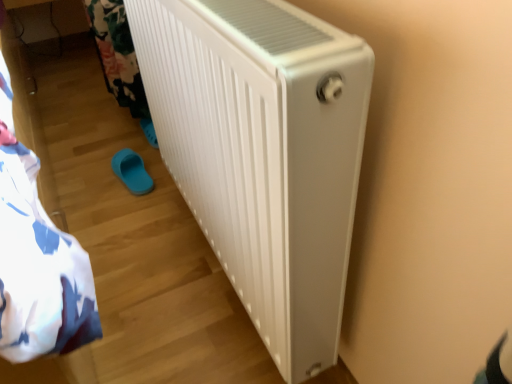
This screenshot has height=384, width=512. Describe the element at coordinates (132, 171) in the screenshot. I see `blue rubber slipper at lower left` at that location.

Locate an element on the screen. The width and height of the screenshot is (512, 384). blue rubber slipper at lower left is located at coordinates (132, 171).

Image resolution: width=512 pixels, height=384 pixels. In order to click on white plastic radiator at center in this screenshot , I will do (263, 154).

Describe the element at coordinates (263, 154) in the screenshot. I see `white plastic radiator at center` at that location.

Locate an element on the screen. The height and width of the screenshot is (384, 512). blue rubber slipper at lower left is located at coordinates (132, 171).

Can you confirm if blue rubber slipper at lower left is positioned to the right of white plastic radiator at center?

Incorrect, blue rubber slipper at lower left is not on the right side of white plastic radiator at center.

Based on the photo, which object is more forward, blue rubber slipper at lower left or white plastic radiator at center?

white plastic radiator at center is in front.

Does point (126, 158) come farther from viewer compared to point (214, 152)?

Yes, it is.

From the image's perspective, is blue rubber slipper at lower left under white plastic radiator at center?

Indeed, from the image's perspective, blue rubber slipper at lower left is shown beneath white plastic radiator at center.

From a real-world perspective, between blue rubber slipper at lower left and white plastic radiator at center, who is vertically lower?

blue rubber slipper at lower left.

Which object is thinner, blue rubber slipper at lower left or white plastic radiator at center?

blue rubber slipper at lower left.

Between blue rubber slipper at lower left and white plastic radiator at center, which one has more height?

With more height is white plastic radiator at center.

Is blue rubber slipper at lower left smaller than white plastic radiator at center?

Yes, blue rubber slipper at lower left is smaller than white plastic radiator at center.

Can white plastic radiator at center be found inside blue rubber slipper at lower left?

No, white plastic radiator at center is not a part of blue rubber slipper at lower left.

Is there a large distance between blue rubber slipper at lower left and white plastic radiator at center?

blue rubber slipper at lower left is actually quite close to white plastic radiator at center.

Is blue rubber slipper at lower left turned away from white plastic radiator at center?

No, blue rubber slipper at lower left is not facing the opposite direction of white plastic radiator at center.

Locate an element on the screen. The image size is (512, 384). footwear that is under the white plastic radiator at center (from a real-world perspective) is located at coordinates (132, 171).

Which object is positioned more to the left, white plastic radiator at center or blue rubber slipper at lower left?

blue rubber slipper at lower left is more to the left.

Relative to blue rubber slipper at lower left, is white plastic radiator at center in front or behind?

Visually, white plastic radiator at center is located in front of blue rubber slipper at lower left.

Is point (161, 89) behind point (140, 169)?

That is False.

From the image's perspective, would you say white plastic radiator at center is positioned over blue rubber slipper at lower left?

Yes, from the image's perspective, white plastic radiator at center is on top of blue rubber slipper at lower left.

From a real-world perspective, is white plastic radiator at center physically located above or below blue rubber slipper at lower left?

From a real-world perspective, white plastic radiator at center is physically above blue rubber slipper at lower left.

Is white plastic radiator at center wider or thinner than blue rubber slipper at lower left?

white plastic radiator at center is wider than blue rubber slipper at lower left.

Considering the sizes of objects white plastic radiator at center and blue rubber slipper at lower left in the image provided, who is taller, white plastic radiator at center or blue rubber slipper at lower left?

Standing taller between the two is white plastic radiator at center.

In terms of size, does white plastic radiator at center appear bigger or smaller than blue rubber slipper at lower left?

white plastic radiator at center is bigger than blue rubber slipper at lower left.

Consider the image. Is blue rubber slipper at lower left a part of white plastic radiator at center?

No, blue rubber slipper at lower left is not inside white plastic radiator at center.

Is white plastic radiator at center placed right next to blue rubber slipper at lower left?

white plastic radiator at center and blue rubber slipper at lower left are not in contact.

Is white plastic radiator at center facing away from blue rubber slipper at lower left?

No, white plastic radiator at center is not facing the opposite direction of blue rubber slipper at lower left.

In order to click on home appliance on the right side of blue rubber slipper at lower left in this screenshot , I will do `click(263, 154)`.

You are a GUI agent. You are given a task and a screenshot of the screen. Output one action in this format:
    pyautogui.click(x=<x>, y=<y>)
    Task: Click on the home appliance that is in front of the blue rubber slipper at lower left
    The width and height of the screenshot is (512, 384).
    Given the screenshot: What is the action you would take?
    pyautogui.click(x=263, y=154)

At what (x,y) coordinates should I click in order to perform the action: click on home appliance on the right of blue rubber slipper at lower left. Please return your answer as a coordinate pair (x, y). Image resolution: width=512 pixels, height=384 pixels. Looking at the image, I should click on (263, 154).